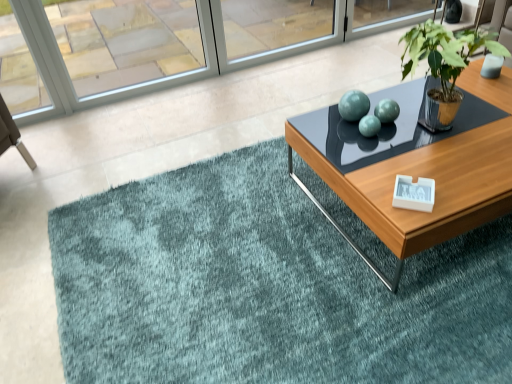
Question: Is green metallic plant pot at upper right far away from clear glass window at upper left?

Choices:
 (A) no
 (B) yes

Answer: (B)

Question: Is green metallic plant pot at upper right positioned in front of clear glass window at upper left?

Choices:
 (A) yes
 (B) no

Answer: (A)

Question: Does green metallic plant pot at upper right come behind clear glass window at upper left?

Choices:
 (A) yes
 (B) no

Answer: (B)

Question: Does green metallic plant pot at upper right have a lesser width compared to clear glass window at upper left?

Choices:
 (A) yes
 (B) no

Answer: (B)

Question: Can you confirm if green metallic plant pot at upper right is taller than clear glass window at upper left?

Choices:
 (A) no
 (B) yes

Answer: (A)

Question: Is clear glass window at upper left located within green metallic plant pot at upper right?

Choices:
 (A) yes
 (B) no

Answer: (B)

Question: Can you confirm if teal plush rug at center is shorter than clear glass window at upper left?

Choices:
 (A) yes
 (B) no

Answer: (A)

Question: Does teal plush rug at center have a lesser width compared to clear glass window at upper left?

Choices:
 (A) no
 (B) yes

Answer: (A)

Question: From a real-world perspective, is teal plush rug at center beneath clear glass window at upper left?

Choices:
 (A) no
 (B) yes

Answer: (B)

Question: Is there a large distance between teal plush rug at center and clear glass window at upper left?

Choices:
 (A) yes
 (B) no

Answer: (A)

Question: Is teal plush rug at center smaller than clear glass window at upper left?

Choices:
 (A) yes
 (B) no

Answer: (B)

Question: From the image's perspective, does teal plush rug at center appear lower than clear glass window at upper left?

Choices:
 (A) yes
 (B) no

Answer: (A)

Question: Is green metallic plant pot at upper right positioned with its back to teal plush rug at center?

Choices:
 (A) no
 (B) yes

Answer: (A)